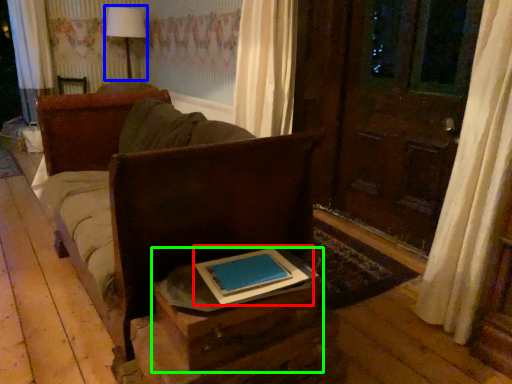
Question: Which object is positioned closest to book (highlighted by a red box)? Select from table lamp (highlighted by a blue box) and table (highlighted by a green box).

Choices:
 (A) table lamp
 (B) table

Answer: (B)